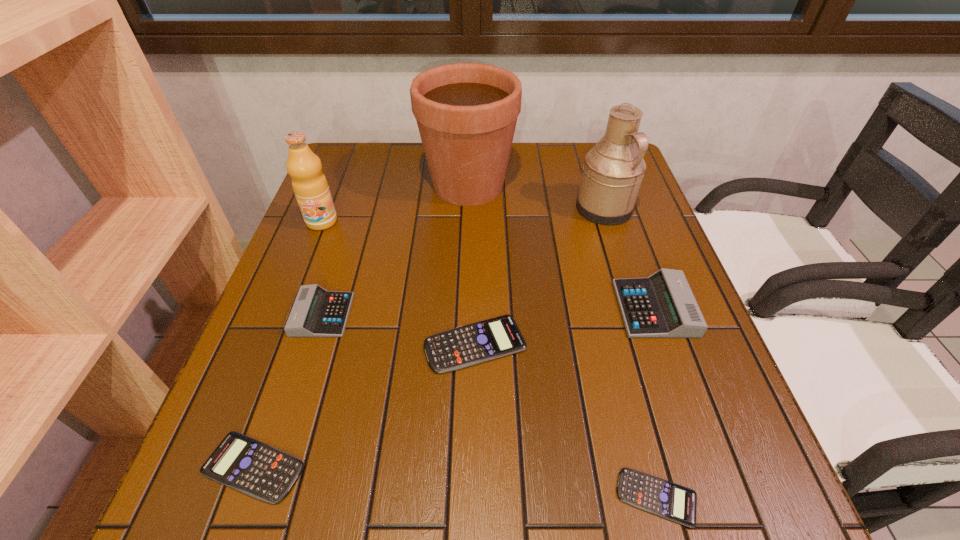
This screenshot has width=960, height=540. Identify the location of vacant space located on the left of the rightmost blue calculator. (480, 497).

Where is `object that is at the far edge`? object that is at the far edge is located at coordinates (466, 113).

Locate an element on the screen. This screenshot has height=540, width=960. fruit juice that is at the left edge is located at coordinates (309, 183).

Identify the location of pitcher at the right edge. Image resolution: width=960 pixels, height=540 pixels. (613, 170).

Where is `object positioned at the near left corner`? object positioned at the near left corner is located at coordinates tap(259, 470).

You are a GUI agent. You are given a task and a screenshot of the screen. Output one action in this format:
    pyautogui.click(x=<x>, y=<y>)
    Task: Click on the object present at the near right corner
    This screenshot has width=960, height=540.
    Given the screenshot: What is the action you would take?
    pyautogui.click(x=663, y=498)

Find the location of a particular element. The height and width of the screenshot is (540, 960). vacant space at the far edge of the desktop is located at coordinates (387, 177).

In the image, there is a desktop. What are the coordinates of `free region at the near edge` in the screenshot? It's located at (507, 525).

Where is `free space at the left edge of the desktop`? Image resolution: width=960 pixels, height=540 pixels. free space at the left edge of the desktop is located at coordinates (259, 429).

Locate an element on the screen. The image size is (960, 540). blank space at the right edge is located at coordinates (646, 371).